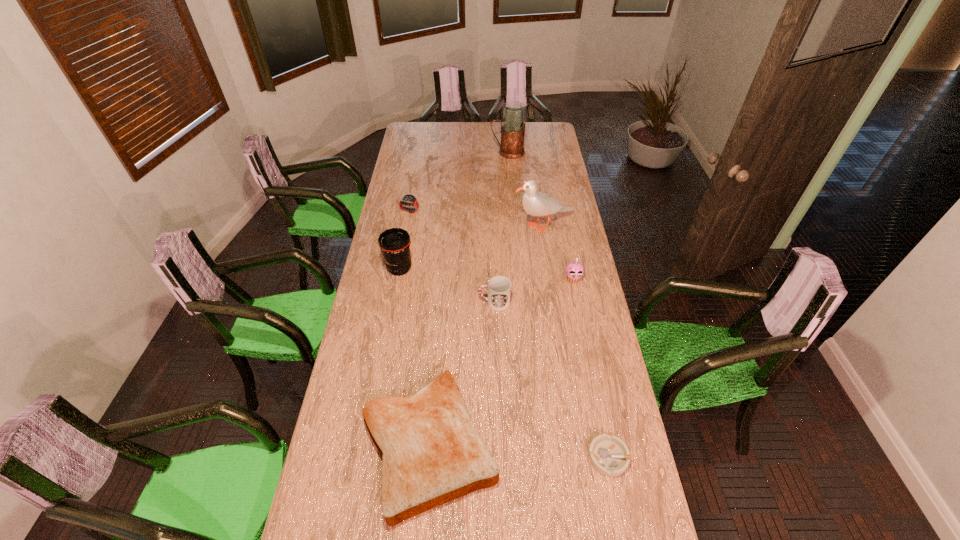
Locate an element on the screen. the farthest object is located at coordinates (513, 128).

At what (x,y) coordinates should I click in order to perform the action: click on the third farthest object. Please return your answer as a coordinate pair (x, y). Looking at the image, I should click on (535, 203).

Locate an element on the screen. This screenshot has height=540, width=960. the sixth shortest object is located at coordinates (394, 243).

Where is `cupcake`? The image size is (960, 540). cupcake is located at coordinates (575, 269).

Where is `the fourth shortest object`? This screenshot has height=540, width=960. the fourth shortest object is located at coordinates (499, 287).

Where is `the third nearest object`? The height and width of the screenshot is (540, 960). the third nearest object is located at coordinates (499, 287).

The image size is (960, 540). Identify the location of watch. (409, 200).

I want to click on bread, so click(x=431, y=452).

At what (x,y) coordinates should I click in order to perform the action: click on ashtray. Please return your answer as a coordinate pair (x, y). The width and height of the screenshot is (960, 540). Looking at the image, I should click on (609, 455).

Image resolution: width=960 pixels, height=540 pixels. Identify the location of vacant space located 0.340m with the handle on the side of the pitcher. (431, 152).